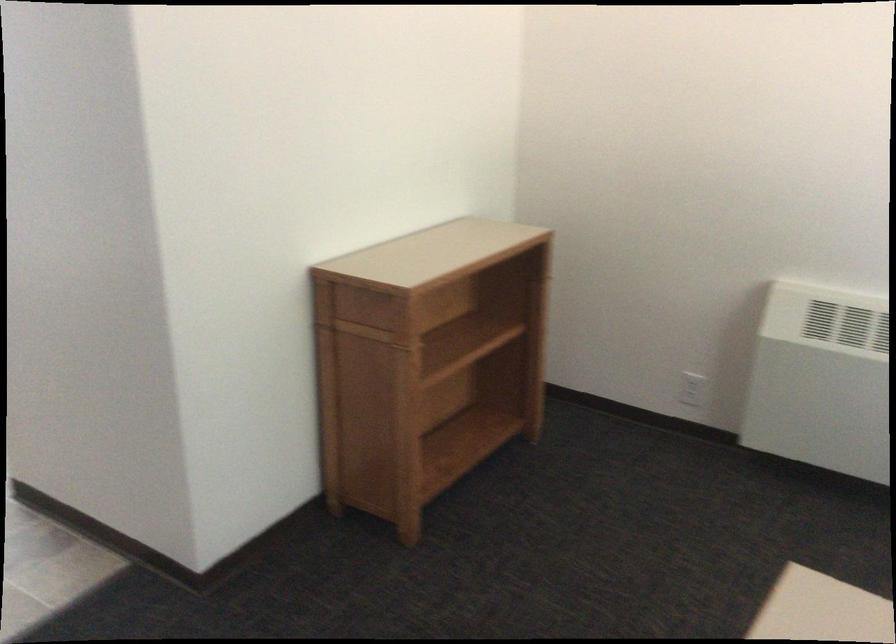
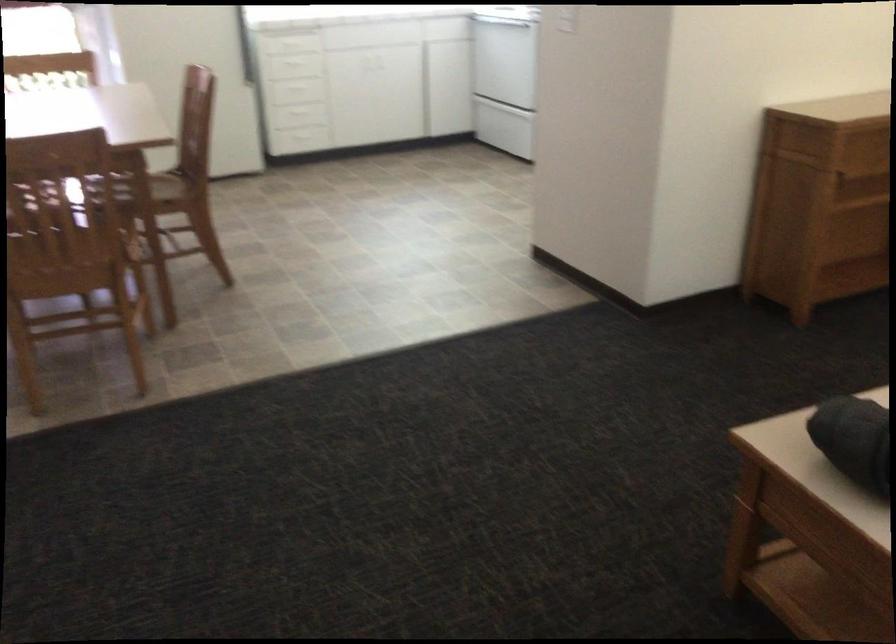
Question: The images are taken continuously from a first-person perspective. In which direction is your viewpoint rotating?

Choices:
 (A) Left
 (B) Right
 (C) Up
 (D) Down

Answer: (A)